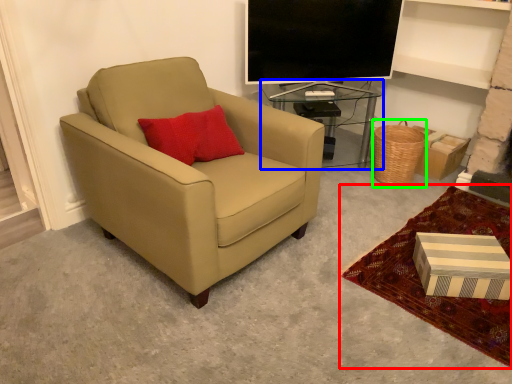
Question: Which is nearer to the plain (highlighted by a red box)? table (highlighted by a blue box) or basket (highlighted by a green box).

Choices:
 (A) table
 (B) basket

Answer: (B)